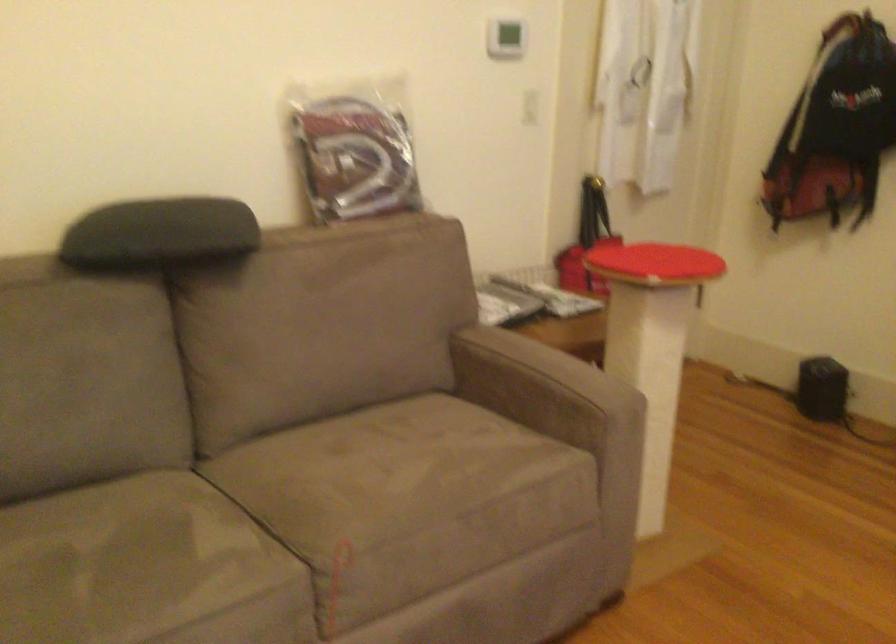
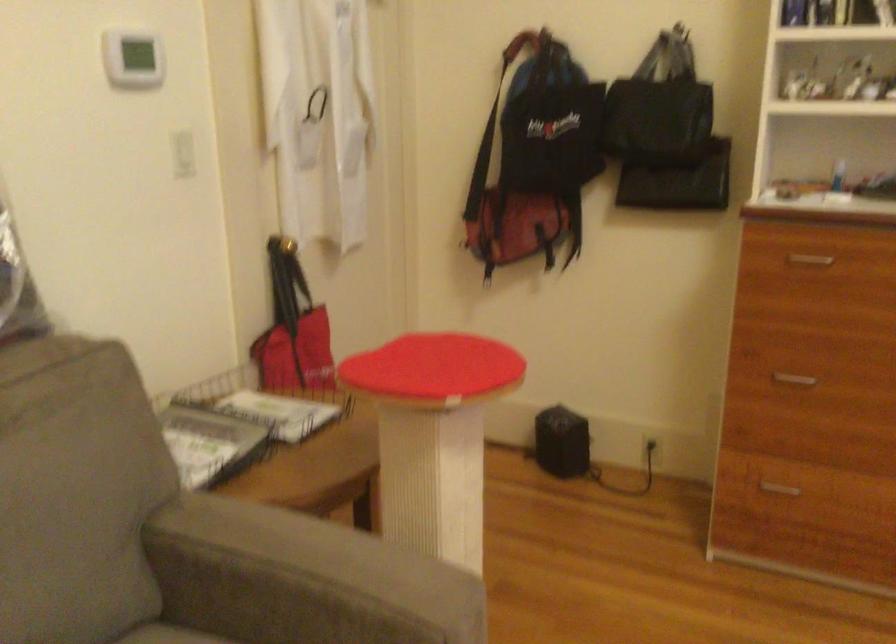
Where in the second image is the point corresponding to [648,258] from the first image?

(434, 366)